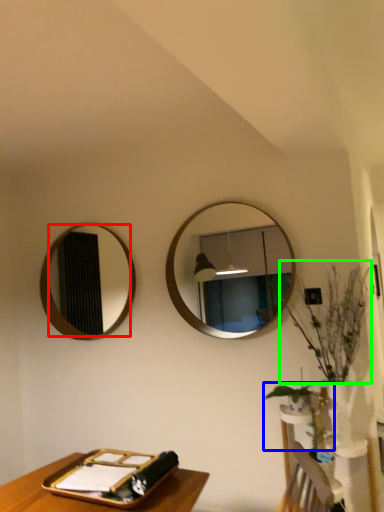
Question: Which object is positioned closest to mirror (highlighted by a red box)? Select from plant (highlighted by a blue box) and floral arrangement (highlighted by a green box).

Choices:
 (A) plant
 (B) floral arrangement

Answer: (A)